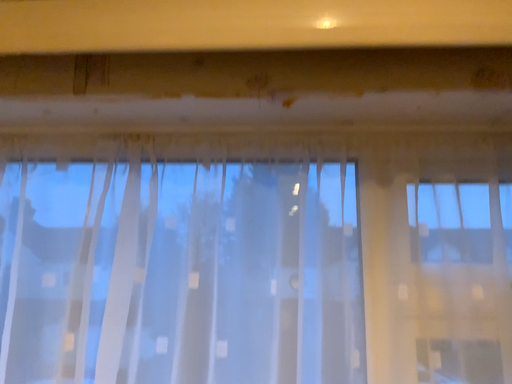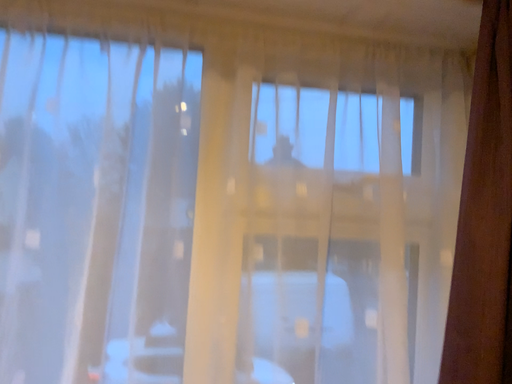
Question: How did the camera likely rotate when shooting the video?

Choices:
 (A) rotated downward
 (B) rotated upward

Answer: (A)